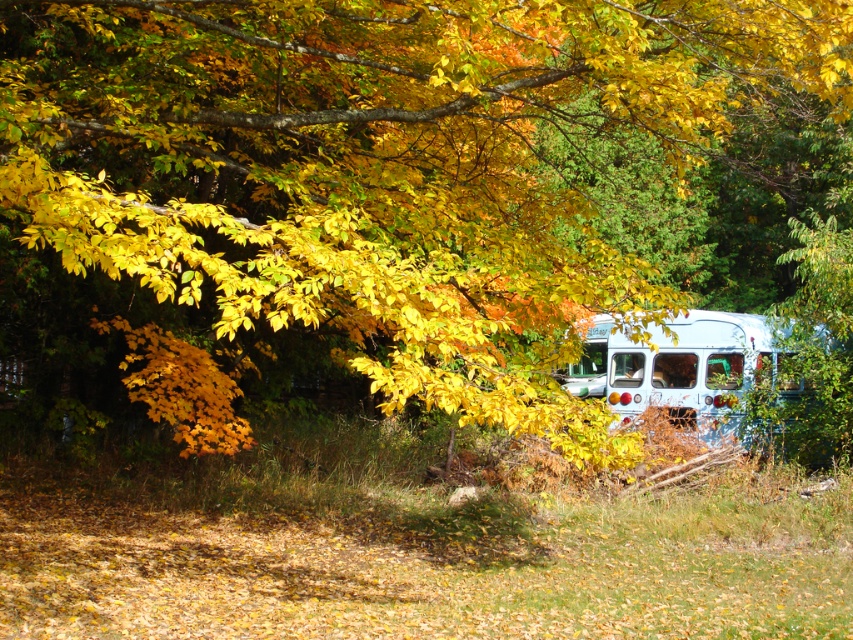
Question: Which of the following is the farthest from the observer?

Choices:
 (A) (444, 276)
 (B) (779, 323)

Answer: (B)

Question: Among these objects, which one is farthest from the camera?

Choices:
 (A) yellow matte leaves at upper center
 (B) white matte school bus at right

Answer: (B)

Question: Which object is farther from the camera taking this photo?

Choices:
 (A) white matte school bus at right
 (B) yellow matte leaves at upper center

Answer: (A)

Question: Is yellow matte leaves at upper center smaller than white matte school bus at right?

Choices:
 (A) no
 (B) yes

Answer: (A)

Question: Does yellow matte leaves at upper center lie behind white matte school bus at right?

Choices:
 (A) yes
 (B) no

Answer: (B)

Question: Does yellow matte leaves at upper center come behind white matte school bus at right?

Choices:
 (A) yes
 (B) no

Answer: (B)